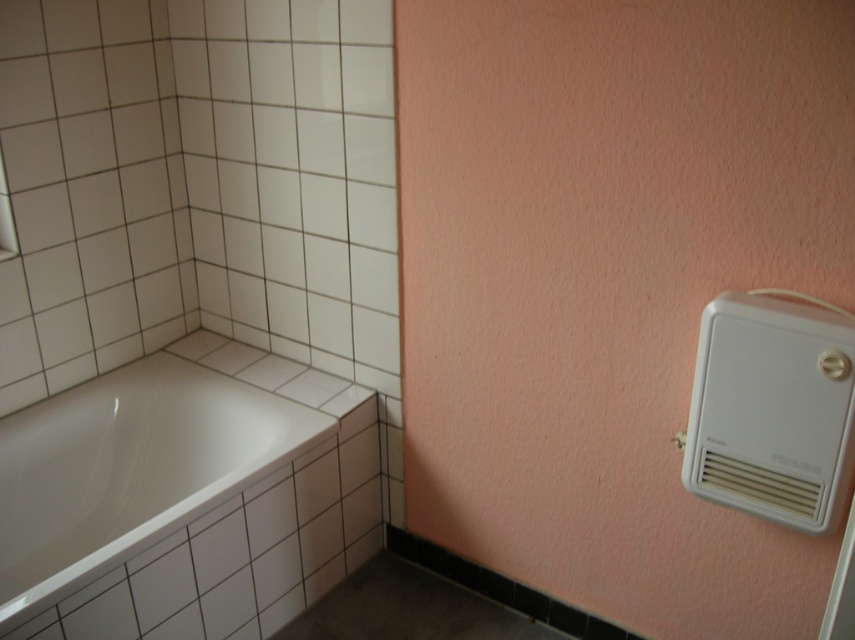
You are standing in the bathroom and want to reach the white plastic air conditioner at right from the white glossy bathtub at lower left. Which direction should you move?

Since the white glossy bathtub at lower left is to the left of the white plastic air conditioner at right, you should move to the right to reach it.

Based on the photo, you are standing in the bathroom and want to locate the white glossy bathtub at lower left. According to the scene description, where would you find it?

The white glossy bathtub at lower left is located at the left side of the bathroom, near the tiled surround with square white tiles and black grout lines. It is positioned at the lower part of the scene, specifically at coordinates point [128,468].

You are a delivery person who needs to place a new white plastic air conditioner at right into the bathroom. The existing white glossy bathtub at lower left is in the way. Can you move the bathtub to make space for the air conditioner?

The white glossy bathtub at lower left has a larger size compared to white plastic air conditioner at right. Moving the bathtub might be difficult due to its size and weight, so it is not advisable to move it. Instead, consider placing the new air conditioner in another location where there is more space.